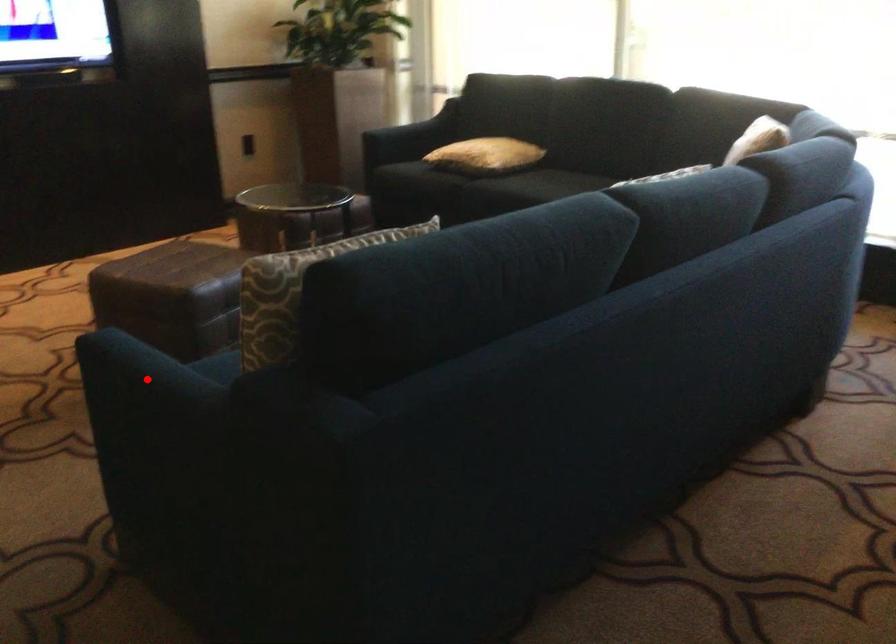
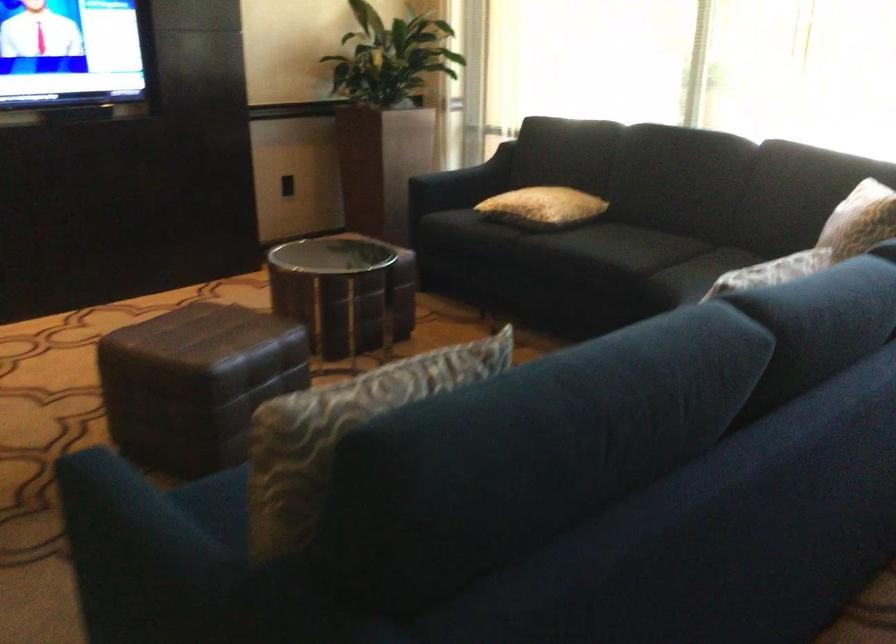
Question: I am providing you with two images of the same scene from different viewpoints. Image1 has a red point marked. In image2, the corresponding 3D location appears at what relative position? Reply with the corresponding letter.

Choices:
 (A) Closer
 (B) Farther

Answer: (A)